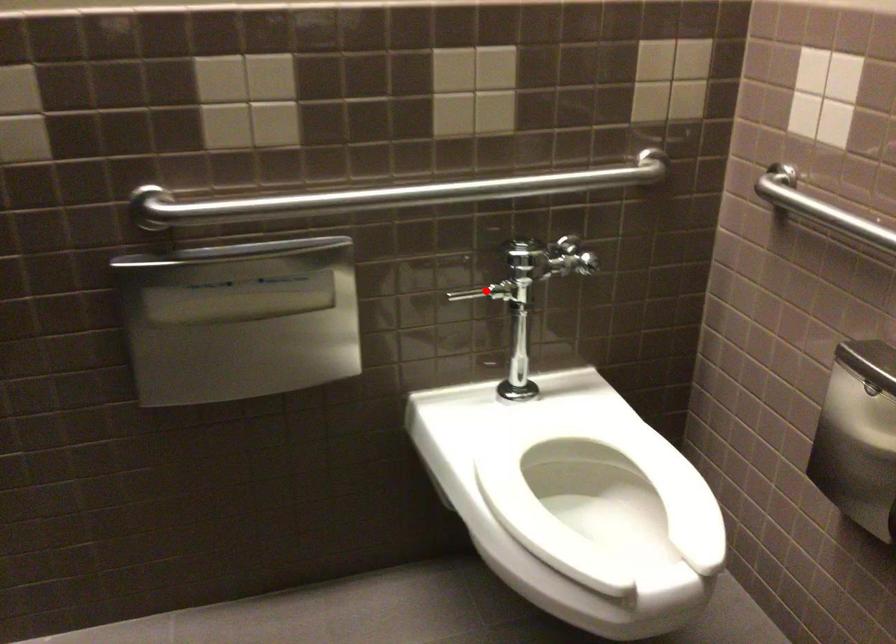
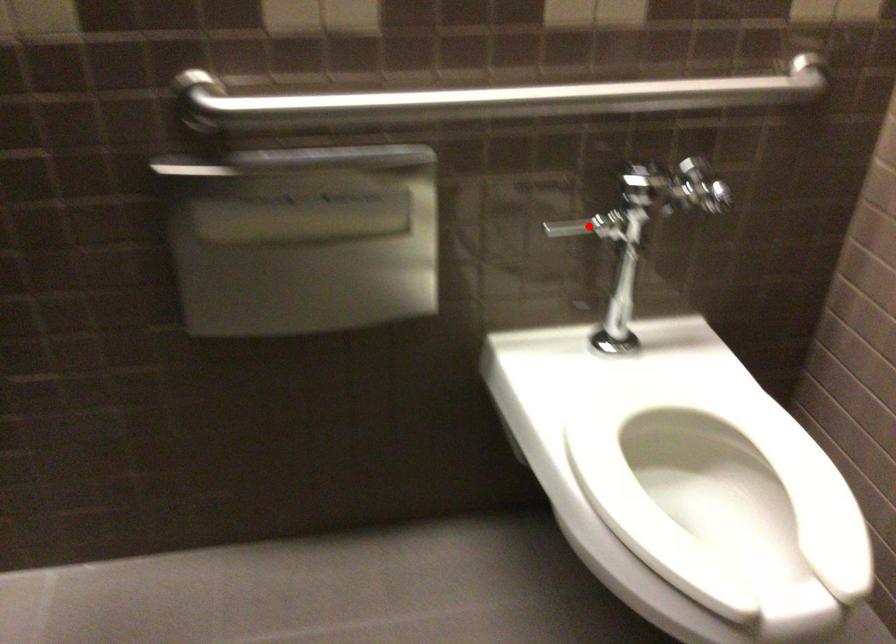
I am providing you with two images of the same scene from different viewpoints. A red point is marked on the first image and another point is marked on the second image. Are the points marked in image1 and image2 representing the same 3D position?

Yes